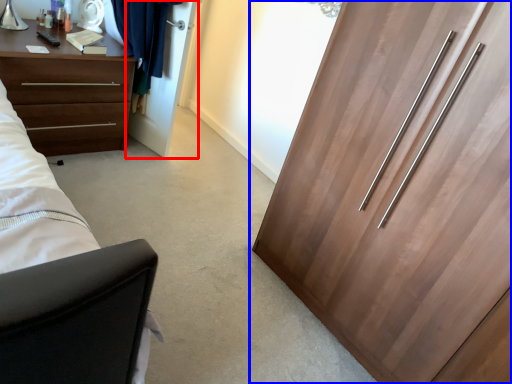
Question: Which of the following is the closest to the observer, door (highlighted by a red box) or cupboard (highlighted by a blue box)?

Choices:
 (A) door
 (B) cupboard

Answer: (B)